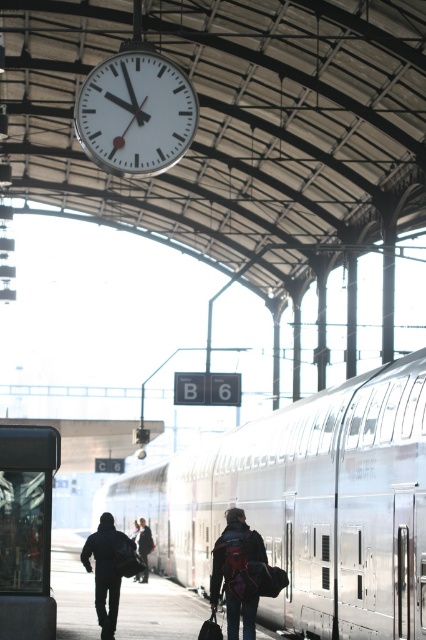
You are standing on the train station platform and see the silver metallic train at center. If you want to locate it precisely, where would you find it in terms of coordinates?

The silver metallic train at center is located at coordinates point [307,504].

You are a delivery robot with a width of 0.8 meters. You need to move from the matte black backpack at center to the dark blue jacket at center. Is there enough space between them for you to pass through?

The distance between the matte black backpack at center and the dark blue jacket at center is 3.03 meters. Since the robot is only 0.8 meters wide, there is sufficient space for it to pass through the 3.03 meter gap.